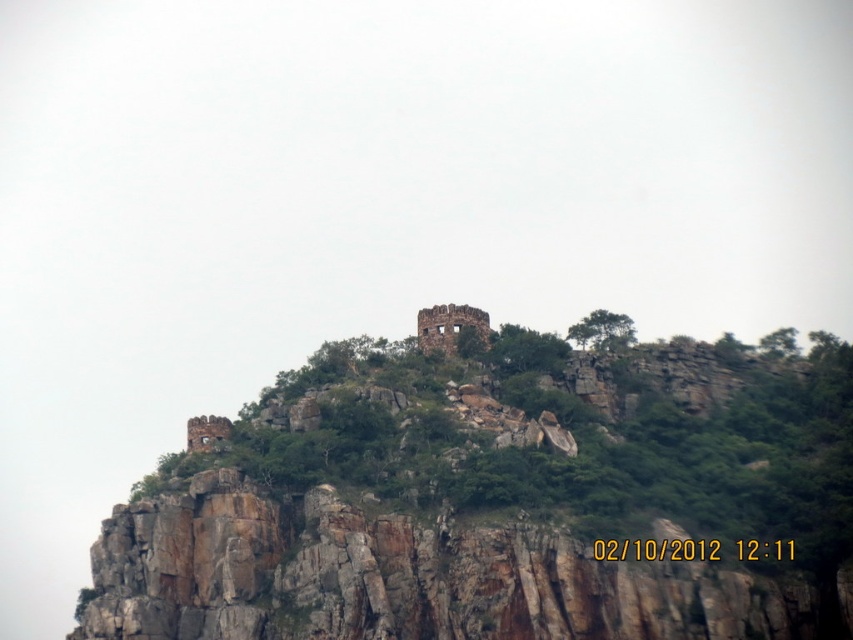
Does point (619, 499) come behind point (445, 323)?

No, it is in front of (445, 323).

Between point (91, 547) and point (421, 321), which one is positioned in front?

Point (91, 547)

Which is behind, point (538, 342) or point (486, 344)?

The point (486, 344) is more distant.

At what (x,y) coordinates should I click in order to perform the action: click on rusty stone ruins at upper center. Please return your answer as a coordinate pair (x, y). The image size is (853, 640). Looking at the image, I should click on (502, 499).